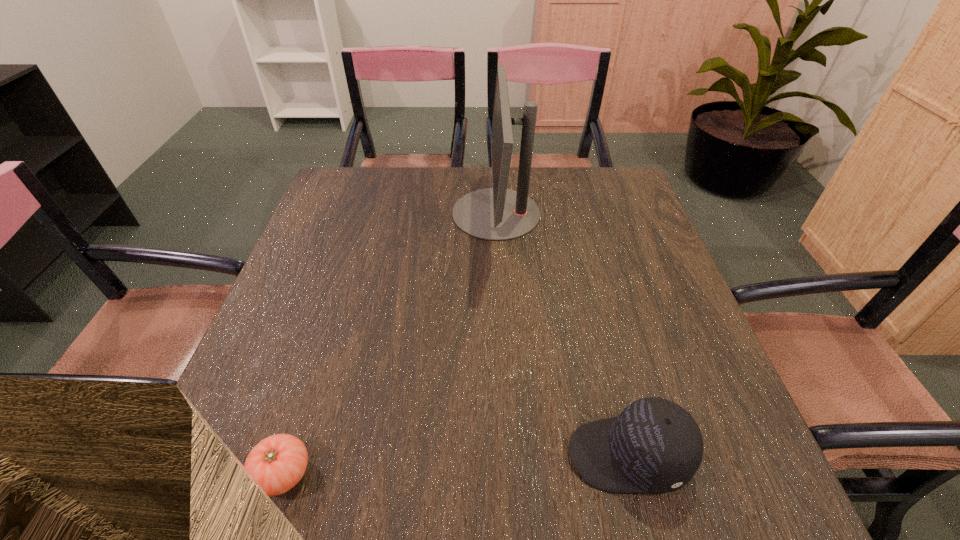
Where is `vacant space at the near edge of the desktop`? The image size is (960, 540). vacant space at the near edge of the desktop is located at coordinates (486, 460).

In the image, there is a desktop. Find the location of `vacant space at the left edge`. vacant space at the left edge is located at coordinates (342, 302).

This screenshot has width=960, height=540. I want to click on free space at the right edge of the desktop, so click(640, 225).

I want to click on vacant area at the far right corner, so click(613, 190).

In the image, there is a desktop. Identify the location of vacant space at the near right corner. This screenshot has height=540, width=960. (702, 478).

Find the location of `free spot between the shortest object and the baseball cap`. free spot between the shortest object and the baseball cap is located at coordinates (456, 464).

This screenshot has height=540, width=960. I want to click on unoccupied position between the leftmost object and the farthest object, so click(390, 343).

Identify the location of empty location between the baseball cap and the farthest object. The height and width of the screenshot is (540, 960). (563, 334).

This screenshot has width=960, height=540. I want to click on vacant space that is in between the leftmost object and the farthest object, so click(x=390, y=343).

Find the location of `empty location between the second tallest object and the farthest object`. empty location between the second tallest object and the farthest object is located at coordinates (563, 334).